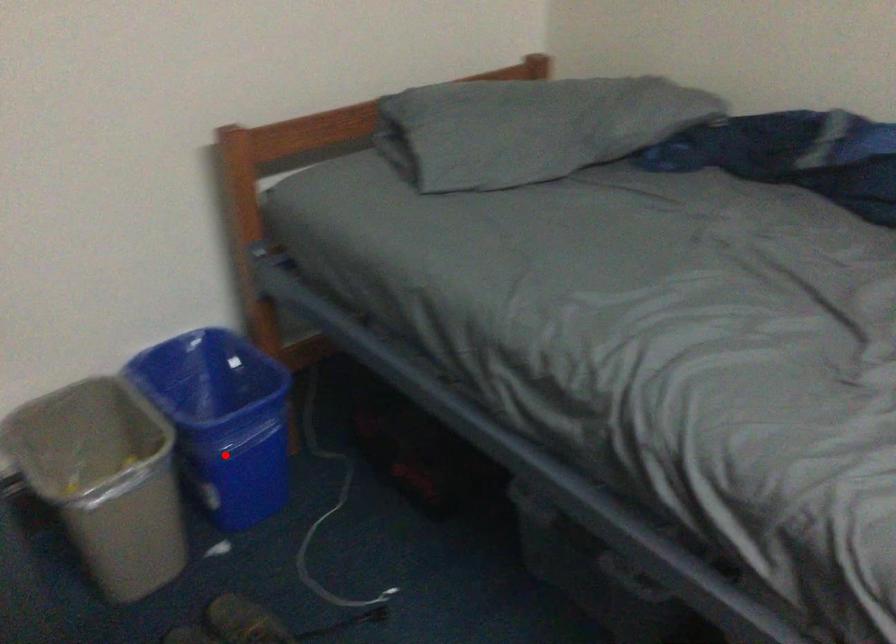
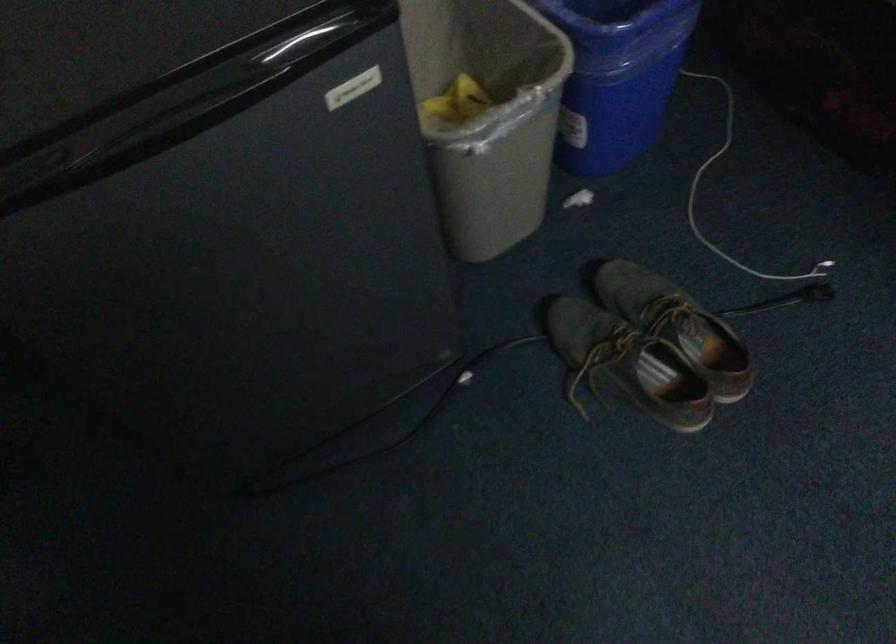
Question: I am providing you with two images of the same scene from different viewpoints. Image1 has a red point marked. In image2, the corresponding 3D location appears at what relative position? Reply with the corresponding letter.

Choices:
 (A) Closer
 (B) Farther

Answer: (A)